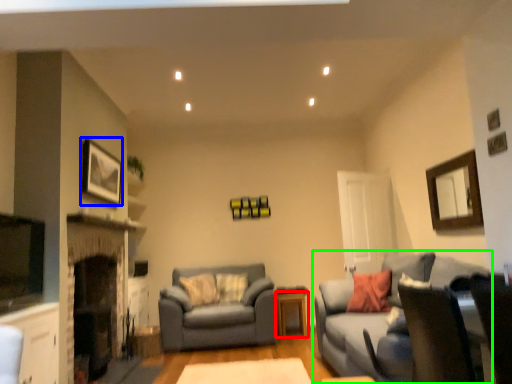
Question: Which is nearer to the table (highlighted by a red box)? picture frame (highlighted by a blue box) or studio couch (highlighted by a green box).

Choices:
 (A) picture frame
 (B) studio couch

Answer: (B)